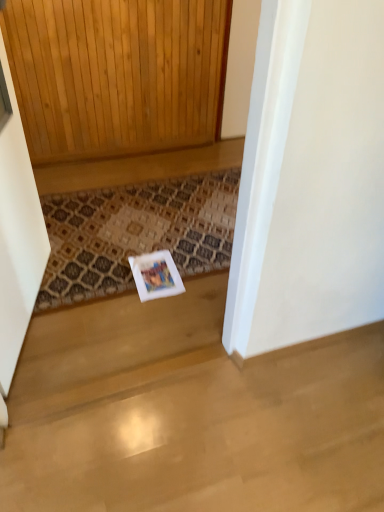
Question: Visually, is patterned carpet at center positioned to the left or to the right of white wood screen door at left?

Choices:
 (A) left
 (B) right

Answer: (B)

Question: Is patterned carpet at center wider or thinner than white wood screen door at left?

Choices:
 (A) wide
 (B) thin

Answer: (A)

Question: Is patterned carpet at center in front of or behind white wood screen door at left in the image?

Choices:
 (A) front
 (B) behind

Answer: (B)

Question: Considering their positions, is white wood screen door at left located in front of or behind patterned carpet at center?

Choices:
 (A) behind
 (B) front

Answer: (B)

Question: From a real-world perspective, is white wood screen door at left above or below patterned carpet at center?

Choices:
 (A) above
 (B) below

Answer: (A)

Question: Is white wood screen door at left situated inside patterned carpet at center or outside?

Choices:
 (A) inside
 (B) outside

Answer: (B)

Question: Is white wood screen door at left taller or shorter than patterned carpet at center?

Choices:
 (A) tall
 (B) short

Answer: (A)